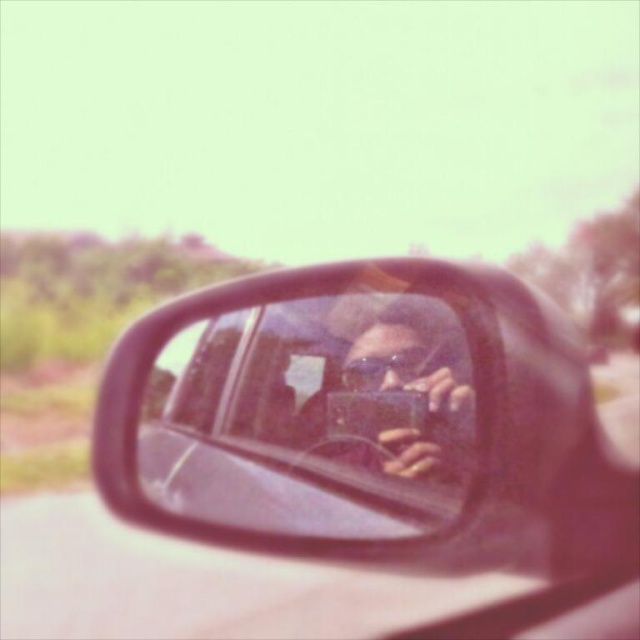
Does shiny black mirror at center have a lesser height compared to matte black camera at center?

Incorrect, shiny black mirror at center's height does not fall short of matte black camera at center's.

The height and width of the screenshot is (640, 640). I want to click on shiny black mirror at center, so click(x=316, y=417).